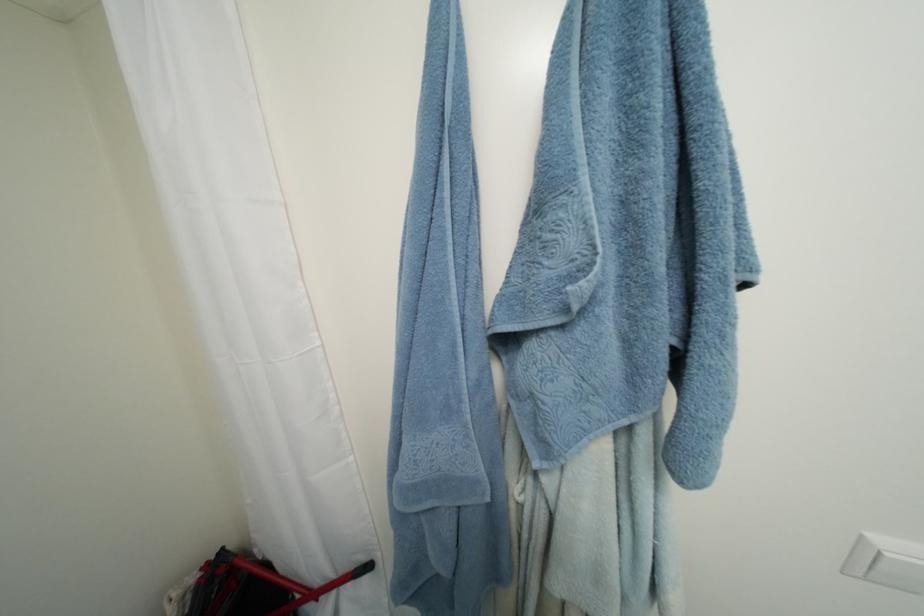
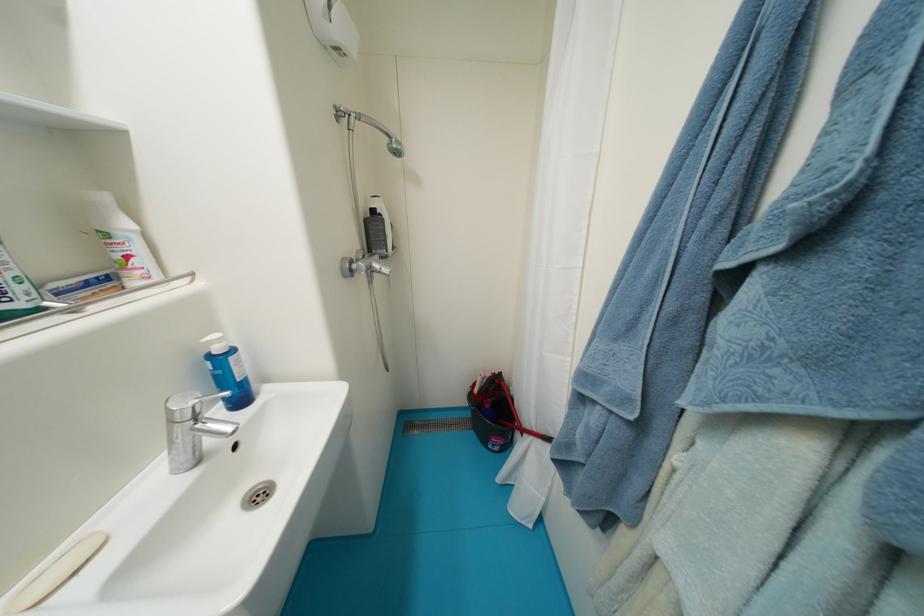
The point at (262,553) is marked in the first image. Where is the corresponding point in the second image?

(517, 390)